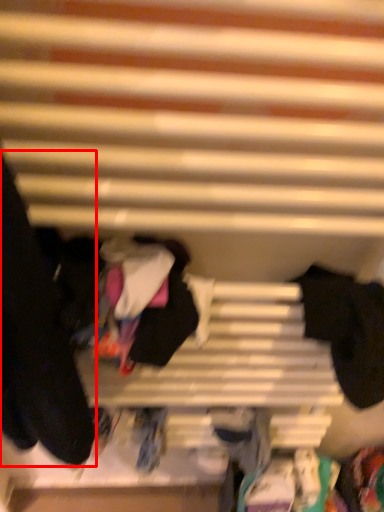
Question: Where is clothing (annotated by the red box) located in relation to clothing in the image?

Choices:
 (A) left
 (B) right

Answer: (A)